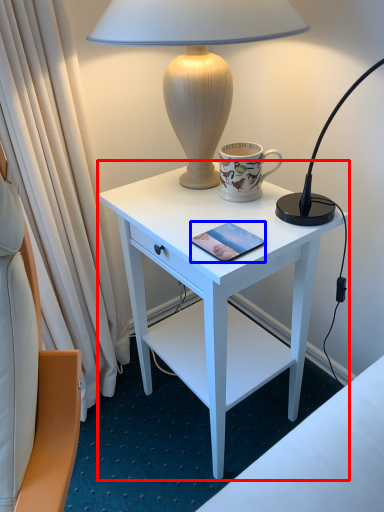
Question: Which of the following is the closest to the observer, desk (highlighted by a red box) or pad (highlighted by a blue box)?

Choices:
 (A) desk
 (B) pad

Answer: (A)